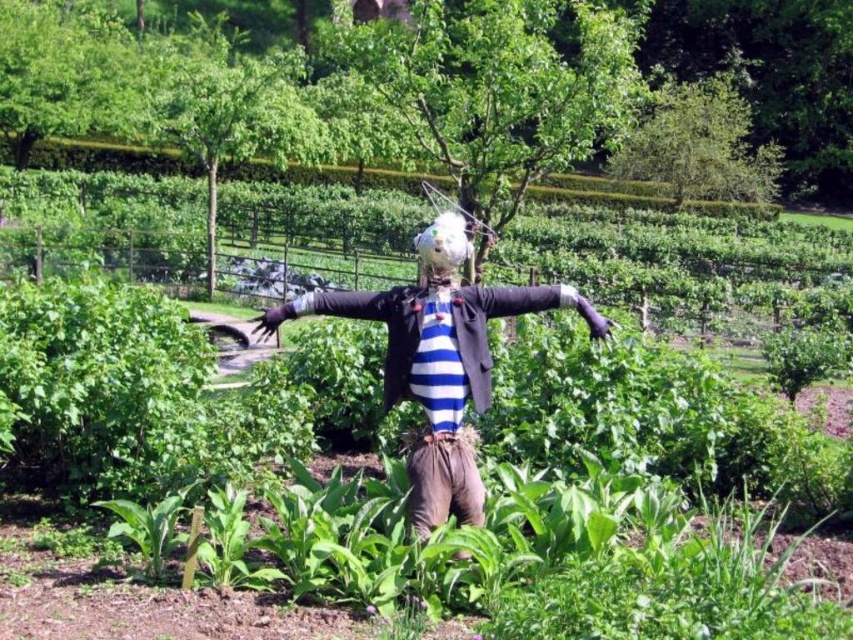
Question: Among these objects, which one is farthest from the camera?

Choices:
 (A) white fabric head at center
 (B) striped fabric scarecrow at center

Answer: (A)

Question: Among these points, which one is farthest from the camera?

Choices:
 (A) (468, 253)
 (B) (424, 515)

Answer: (A)

Question: Is striped fabric scarecrow at center smaller than white fabric head at center?

Choices:
 (A) yes
 (B) no

Answer: (A)

Question: Does striped fabric scarecrow at center appear over white fabric head at center?

Choices:
 (A) no
 (B) yes

Answer: (A)

Question: Which object appears farthest from the camera in this image?

Choices:
 (A) white fabric head at center
 (B) striped fabric scarecrow at center

Answer: (A)

Question: Can you confirm if striped fabric scarecrow at center is thinner than white fabric head at center?

Choices:
 (A) no
 (B) yes

Answer: (A)